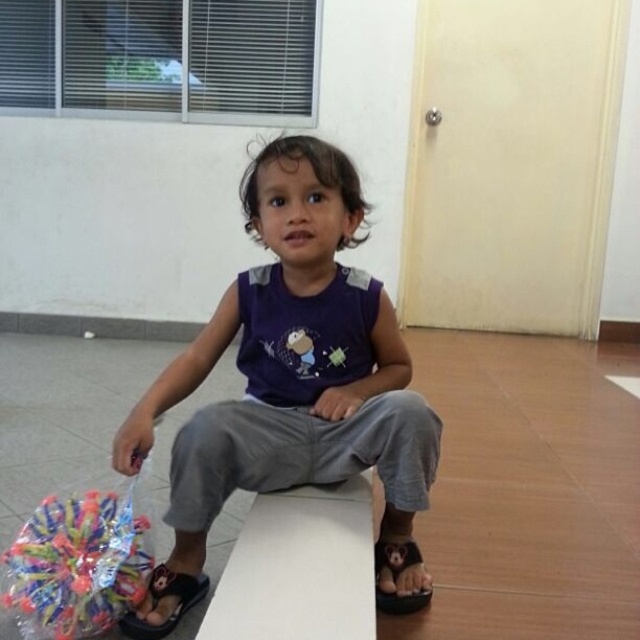
Question: Which point is closer to the camera taking this photo?

Choices:
 (A) (342, 156)
 (B) (179, 576)

Answer: (A)

Question: Where is black rubber sandal at lower left located in relation to black rubber sandal at lower right in the image?

Choices:
 (A) below
 (B) above

Answer: (A)

Question: Can you confirm if purple cotton shirt at center is smaller than black rubber sandal at lower left?

Choices:
 (A) yes
 (B) no

Answer: (B)

Question: Which of these objects is positioned closest to the purple cotton shirt at center?

Choices:
 (A) black rubber sandal at lower right
 (B) translucent plastic toy at lower left

Answer: (B)

Question: Which of the following is the closest to the observer?

Choices:
 (A) (97, 515)
 (B) (374, 547)

Answer: (A)

Question: From the image, what is the correct spatial relationship of purple cotton shirt at center in relation to translucent plastic toy at lower left?

Choices:
 (A) right
 (B) left

Answer: (A)